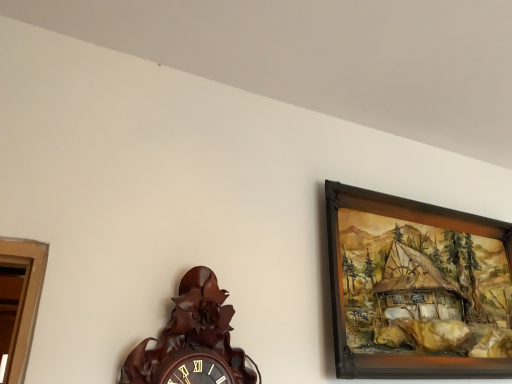
Question: From the image's perspective, is brown wooden wall clock at lower left over wooden picture frame at upper right?

Choices:
 (A) no
 (B) yes

Answer: (A)

Question: Can you confirm if brown wooden wall clock at lower left is thinner than wooden picture frame at upper right?

Choices:
 (A) yes
 (B) no

Answer: (B)

Question: Is brown wooden wall clock at lower left behind wooden picture frame at upper right?

Choices:
 (A) no
 (B) yes

Answer: (A)

Question: From a real-world perspective, is brown wooden wall clock at lower left positioned under wooden picture frame at upper right based on gravity?

Choices:
 (A) no
 (B) yes

Answer: (B)

Question: Considering the relative sizes of brown wooden wall clock at lower left and wooden picture frame at upper right in the image provided, is brown wooden wall clock at lower left wider than wooden picture frame at upper right?

Choices:
 (A) yes
 (B) no

Answer: (A)

Question: Is wooden picture frame at upper right located within brown wooden wall clock at lower left?

Choices:
 (A) yes
 (B) no

Answer: (B)

Question: Is wooden picture frame at upper right taller than brown wooden wall clock at lower left?

Choices:
 (A) yes
 (B) no

Answer: (A)

Question: Considering the relative sizes of wooden picture frame at upper right and brown wooden wall clock at lower left in the image provided, is wooden picture frame at upper right wider than brown wooden wall clock at lower left?

Choices:
 (A) no
 (B) yes

Answer: (A)

Question: Is wooden picture frame at upper right next to brown wooden wall clock at lower left and touching it?

Choices:
 (A) yes
 (B) no

Answer: (B)

Question: Are wooden picture frame at upper right and brown wooden wall clock at lower left far apart?

Choices:
 (A) yes
 (B) no

Answer: (B)

Question: Considering the relative sizes of wooden picture frame at upper right and brown wooden wall clock at lower left in the image provided, is wooden picture frame at upper right thinner than brown wooden wall clock at lower left?

Choices:
 (A) yes
 (B) no

Answer: (A)

Question: Is wooden picture frame at upper right to the left of brown wooden wall clock at lower left from the viewer's perspective?

Choices:
 (A) no
 (B) yes

Answer: (A)

Question: From the image's perspective, relative to wooden picture frame at upper right, is brown wooden wall clock at lower left above or below?

Choices:
 (A) below
 (B) above

Answer: (A)